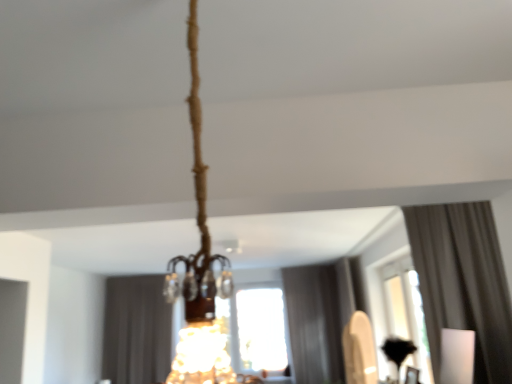
Question: In the image, is dark gray fabric curtain at center, which ranks as the 1th curtain in back-to-front order, on the left side or the right side of transparent glass window at center?

Choices:
 (A) right
 (B) left

Answer: (B)

Question: From their relative heights in the image, would you say dark gray fabric curtain at center, arranged as the 3th curtain when viewed from the front, is taller or shorter than transparent glass window at center?

Choices:
 (A) tall
 (B) short

Answer: (A)

Question: Estimate the real-world distances between objects in this image. Which object is farther from the transparent glass window at center?

Choices:
 (A) gray fabric curtain at center, marked as the second curtain in a front-to-back arrangement
 (B) dark gray fabric curtain at center, acting as the third curtain starting from the right
 (C) white fabric curtain at upper right, the 1th curtain in the front-to-back sequence

Answer: (B)

Question: Estimate the real-world distances between objects in this image. Which object is farther from the dark gray fabric curtain at center, which ranks as the 1th curtain in back-to-front order?

Choices:
 (A) white fabric curtain at upper right, which is the third curtain from back to front
 (B) gray fabric curtain at center, acting as the second curtain starting from the back
 (C) transparent glass window at center

Answer: (A)